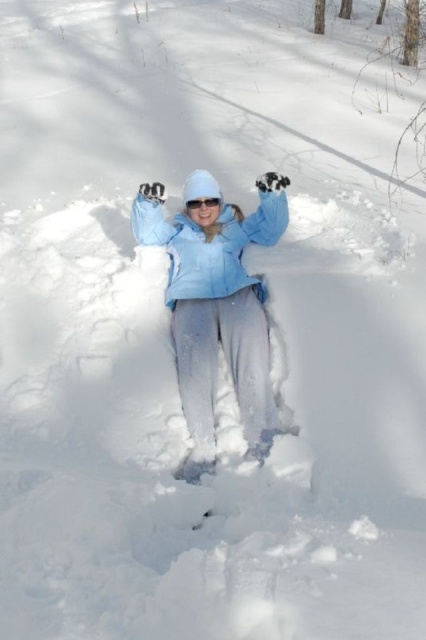
Question: Can you confirm if light blue fabric at center is positioned to the left of matte blue jacket at center?

Choices:
 (A) yes
 (B) no

Answer: (A)

Question: Which object appears farthest from the camera in this image?

Choices:
 (A) light blue fabric at center
 (B) transparent plastic goggles at center

Answer: (B)

Question: Estimate the real-world distances between objects in this image. Which object is farther from the matte blue jacket at center?

Choices:
 (A) light blue fabric at center
 (B) transparent plastic goggles at center

Answer: (B)

Question: Can you confirm if light blue fabric at center is positioned below matte blue jacket at center?

Choices:
 (A) yes
 (B) no

Answer: (A)

Question: Does light blue fabric at center appear on the left side of matte blue jacket at center?

Choices:
 (A) no
 (B) yes

Answer: (B)

Question: Which object appears farthest from the camera in this image?

Choices:
 (A) matte blue jacket at center
 (B) transparent plastic goggles at center

Answer: (B)